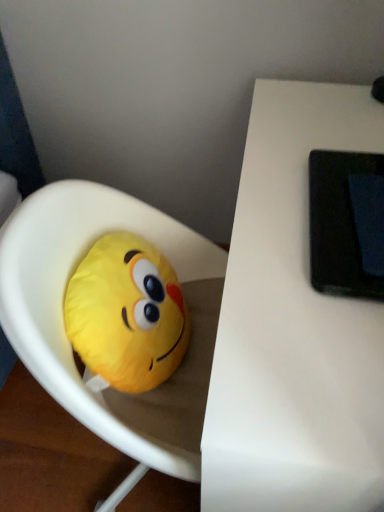
Locate an element on the screen. This screenshot has height=512, width=384. blank space situated above black matte tablet at upper right (from a real-world perspective) is located at coordinates (355, 203).